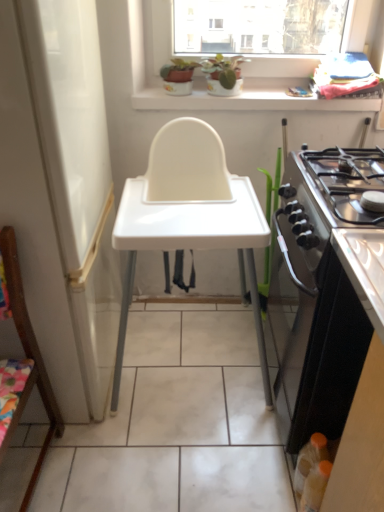
Question: Does point (246, 82) appear closer or farther from the camera than point (309, 332)?

Choices:
 (A) closer
 (B) farther

Answer: (B)

Question: From a real-world perspective, is white glossy window sill at upper center physically located above or below black glossy oven at right?

Choices:
 (A) above
 (B) below

Answer: (A)

Question: Based on their relative distances, which object is farther from the black glossy oven at right?

Choices:
 (A) translucent plastic bottle at lower right
 (B) white plastic changing table at center
 (C) white glossy screen door at center
 (D) stainless steel gas stove at right
 (E) wooden chair at left

Answer: (E)

Question: Which object is the farthest from the translucent plastic bottle at lower right?

Choices:
 (A) white plastic changing table at center
 (B) white glossy window sill at upper center
 (C) wooden chair at left
 (D) stainless steel gas stove at right
 (E) white glossy screen door at center

Answer: (B)